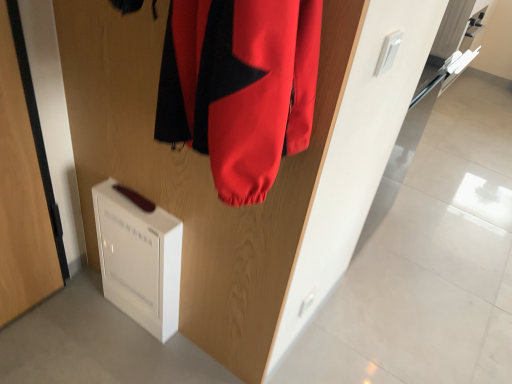
I want to click on spots to the right of white matte door at lower left, which is counted as the first door, starting from the left, so click(x=78, y=316).